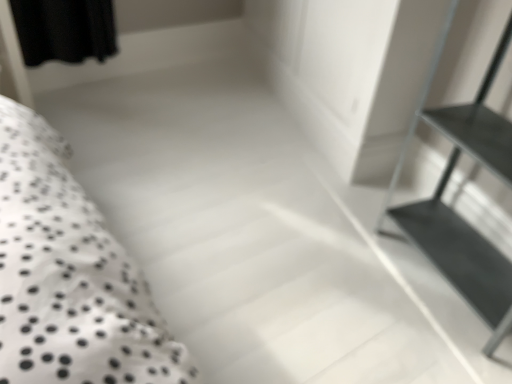
I want to click on metallic gray shelf at right, so click(452, 209).

The height and width of the screenshot is (384, 512). What do you see at coordinates (452, 209) in the screenshot?
I see `metallic gray shelf at right` at bounding box center [452, 209].

At what (x,y) coordinates should I click in order to perform the action: click on metallic gray shelf at right. Please return your answer as a coordinate pair (x, y). The width and height of the screenshot is (512, 384). Looking at the image, I should click on (452, 209).